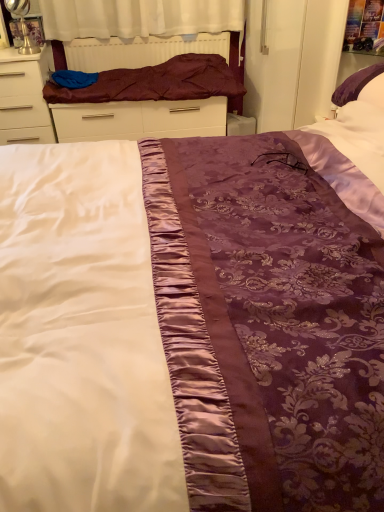
Question: From the image's perspective, is white glossy chest of drawers at left below maroon satin blanket at upper left?

Choices:
 (A) no
 (B) yes

Answer: (B)

Question: From a real-world perspective, is white glossy chest of drawers at left on top of maroon satin blanket at upper left?

Choices:
 (A) yes
 (B) no

Answer: (B)

Question: Does white glossy chest of drawers at left appear on the right side of maroon satin blanket at upper left?

Choices:
 (A) no
 (B) yes

Answer: (A)

Question: From a real-world perspective, is white glossy chest of drawers at left positioned under maroon satin blanket at upper left based on gravity?

Choices:
 (A) no
 (B) yes

Answer: (B)

Question: Are white glossy chest of drawers at left and maroon satin blanket at upper left far apart?

Choices:
 (A) yes
 (B) no

Answer: (B)

Question: Is white glossy chest of drawers at left closer to the viewer compared to maroon satin blanket at upper left?

Choices:
 (A) no
 (B) yes

Answer: (B)

Question: Are white glossy chest of drawers at left and maroon satin bed frame at upper center located far from each other?

Choices:
 (A) no
 (B) yes

Answer: (A)

Question: From the image's perspective, is white glossy chest of drawers at left located above maroon satin bed frame at upper center?

Choices:
 (A) no
 (B) yes

Answer: (A)

Question: Is white glossy chest of drawers at left completely or partially outside of maroon satin bed frame at upper center?

Choices:
 (A) no
 (B) yes

Answer: (B)

Question: Is white glossy chest of drawers at left facing towards maroon satin bed frame at upper center?

Choices:
 (A) no
 (B) yes

Answer: (A)

Question: Is white glossy chest of drawers at left shorter than maroon satin bed frame at upper center?

Choices:
 (A) yes
 (B) no

Answer: (B)

Question: From a real-world perspective, is white glossy chest of drawers at left below maroon satin bed frame at upper center?

Choices:
 (A) no
 (B) yes

Answer: (B)

Question: Is maroon satin blanket at upper left facing towards white glossy chest of drawers at left?

Choices:
 (A) no
 (B) yes

Answer: (A)